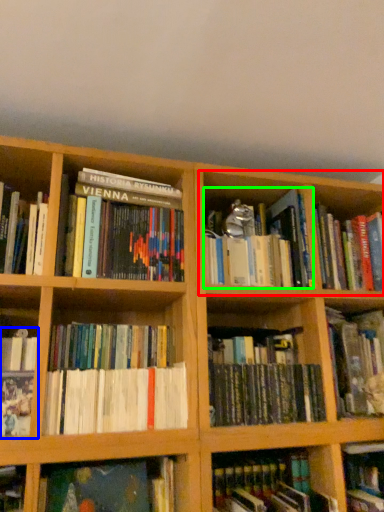
Question: Which is nearer to the cabinet (highlighted by a red box)? book (highlighted by a blue box) or book (highlighted by a green box).

Choices:
 (A) book
 (B) book

Answer: (B)